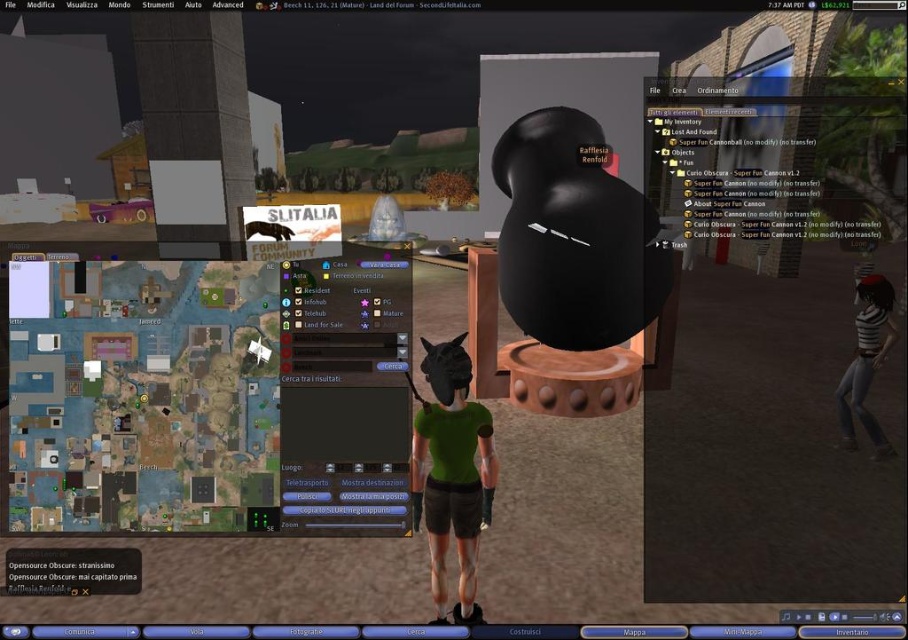
Does green matte shirt at center lie in front of striped fabric shirt at right?

Yes, green matte shirt at center is closer to the viewer.

Is point (462, 589) positioned in front of point (886, 307)?

Yes, point (462, 589) is closer to viewer.

This screenshot has height=640, width=908. Find the location of `green matte shirt at center`. green matte shirt at center is located at coordinates (452, 474).

Can you confirm if matte green map at lower left is positioned to the left of striped fabric shirt at right?

Yes, matte green map at lower left is to the left of striped fabric shirt at right.

Between matte green map at lower left and striped fabric shirt at right, which one has less height?

matte green map at lower left

Locate an element on the screen. The height and width of the screenshot is (640, 908). matte green map at lower left is located at coordinates (211, 396).

Is point (31, 477) positioned behind point (449, 420)?

No, it is not.

Who is taller, matte green map at lower left or green matte shirt at center?

green matte shirt at center is taller.

This screenshot has width=908, height=640. I want to click on matte green map at lower left, so click(211, 396).

You are a GUI agent. You are given a task and a screenshot of the screen. Output one action in this format:
    pyautogui.click(x=<x>, y=<y>)
    Task: Click on the matte green map at lower left
    This screenshot has width=908, height=640.
    Given the screenshot: What is the action you would take?
    pyautogui.click(x=211, y=396)